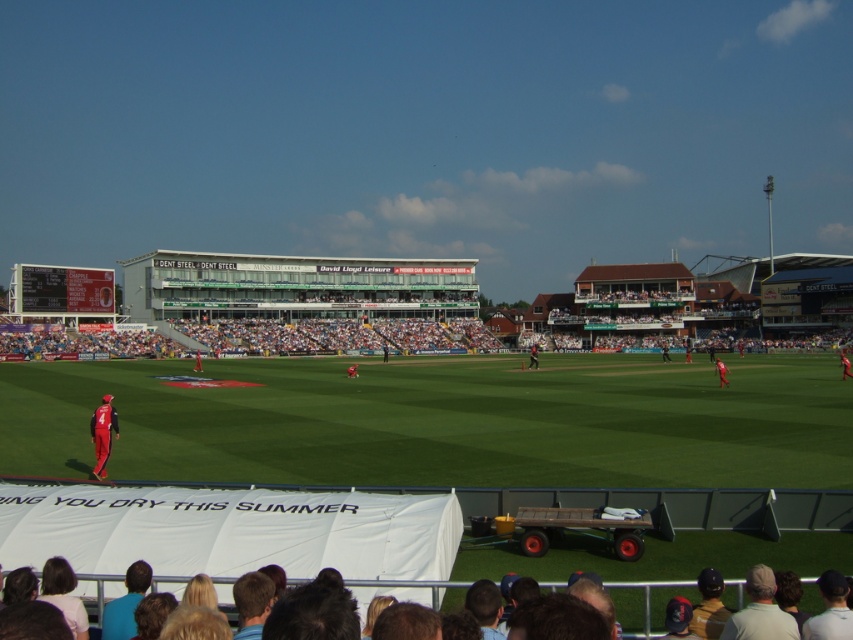
Question: Estimate the real-world distances between objects in this image. Which object is farther from the light brown hair at lower right?

Choices:
 (A) dark blue helmet at lower right
 (B) blonde hair at lower center
 (C) orange fabric person at center
 (D) matte red uniform at lower left

Answer: (C)

Question: Is dark blue helmet at lower right positioned in front of orange fabric person at center?

Choices:
 (A) yes
 (B) no

Answer: (A)

Question: Which of these objects is positioned farthest from the dark blue helmet at lower right?

Choices:
 (A) orange fabric person at center
 (B) dark blue fabric cap at lower right

Answer: (A)

Question: Does dark blue helmet at lower right have a greater width compared to matte red uniform at lower left?

Choices:
 (A) no
 (B) yes

Answer: (A)

Question: Does dark blue fabric cap at lower right have a greater width compared to blonde hair at lower center?

Choices:
 (A) no
 (B) yes

Answer: (B)

Question: Among these objects, which one is farthest from the camera?

Choices:
 (A) blonde hair at lower center
 (B) light brown hair at lower right

Answer: (B)